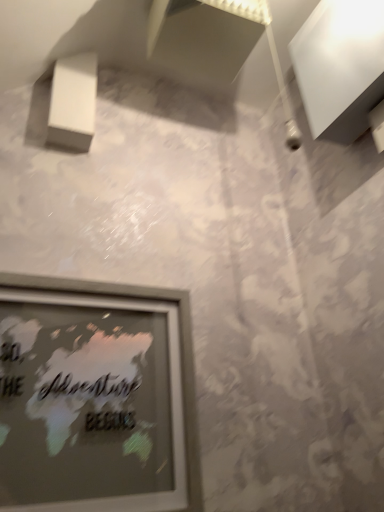
What do you see at coordinates (96, 397) in the screenshot? The width and height of the screenshot is (384, 512). I see `matte gray picture frame at lower left` at bounding box center [96, 397].

You are a GUI agent. You are given a task and a screenshot of the screen. Output one action in this format:
    pyautogui.click(x=<x>, y=<y>)
    Task: Click on the matte gray picture frame at lower left
    This screenshot has height=512, width=384.
    Given the screenshot: What is the action you would take?
    pyautogui.click(x=96, y=397)

The width and height of the screenshot is (384, 512). I want to click on matte gray picture frame at lower left, so click(96, 397).